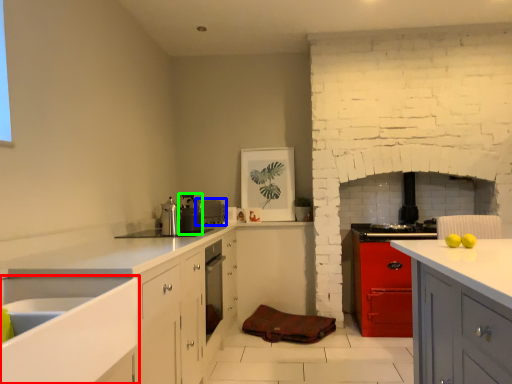
Question: Considering the real-world distances, which object is closest to sink (highlighted by a red box)? appliance (highlighted by a blue box) or appliance (highlighted by a green box).

Choices:
 (A) appliance
 (B) appliance

Answer: (B)